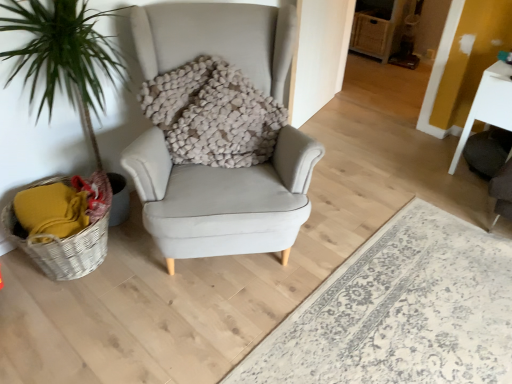
Where is `white glossy table at right`? Image resolution: width=512 pixels, height=384 pixels. white glossy table at right is located at coordinates (489, 105).

Find the location of a particular element. This screenshot has width=512, height=384. fuzzy beige pillow at center is located at coordinates (213, 114).

I want to click on woven wicker basket at lower left, so click(x=63, y=248).

Is light gray fabric armchair at center turned away from fuzzy beige pillow at center?

light gray fabric armchair at center is not turned away from fuzzy beige pillow at center.

Considering the positions of objects light gray fabric armchair at center and fuzzy beige pillow at center in the image provided, who is more to the left, light gray fabric armchair at center or fuzzy beige pillow at center?

fuzzy beige pillow at center.

Is point (343, 380) more distant than point (242, 143)?

No, (343, 380) is in front of (242, 143).

From the image's perspective, which one is positioned lower, light gray fabric armchair at center or fuzzy beige pillow at center?

From the image's view, light gray fabric armchair at center is below.

The width and height of the screenshot is (512, 384). I want to click on plain below the white glossy table at right (from the image's perspective), so click(x=400, y=311).

Is white glossy table at right aimed at light gray fabric armchair at center?

Yes, white glossy table at right faces towards light gray fabric armchair at center.

Is light gray fabric armchair at center a part of white glossy table at right?

That's incorrect, light gray fabric armchair at center is not inside white glossy table at right.

From the image's perspective, is white glossy table at right above light gray fabric armchair at center?

Correct, white glossy table at right appears higher than light gray fabric armchair at center in the image.

How different are the orientations of light gray fabric armchair at center and woven wicker basket at lower left in degrees?

180 degrees separate the facing orientations of light gray fabric armchair at center and woven wicker basket at lower left.

From their relative heights in the image, would you say light gray fabric armchair at center is taller or shorter than woven wicker basket at lower left?

light gray fabric armchair at center is shorter than woven wicker basket at lower left.

Which is in front, point (510, 287) or point (92, 243)?

The point (92, 243) is more forward.

Which is more to the left, woven wicker basket at lower left or light gray fabric armchair at center?

From the viewer's perspective, woven wicker basket at lower left appears more on the left side.

Between woven wicker basket at lower left and light gray fabric armchair at center, which one has less height?

With less height is light gray fabric armchair at center.

Is woven wicker basket at lower left positioned with its back to light gray fabric armchair at center?

No, woven wicker basket at lower left is not facing away from light gray fabric armchair at center.

From the image's perspective, is woven wicker basket at lower left located above or below light gray fabric armchair at center?

→ woven wicker basket at lower left is above light gray fabric armchair at center.

Is fuzzy beige pillow at center in front of or behind light gray fabric armchair at center in the image?

Clearly, fuzzy beige pillow at center is behind light gray fabric armchair at center.

Consider the image. Is fuzzy beige pillow at center wider than light gray fabric armchair at center?

No, fuzzy beige pillow at center is not wider than light gray fabric armchair at center.

From a real-world perspective, is fuzzy beige pillow at center over light gray fabric armchair at center?

Yes.

Measure the distance between fuzzy beige pillow at center and light gray fabric armchair at center.

36.89 inches.

Considering the positions of objects white glossy table at right and woven wicker basket at lower left in the image provided, who is in front, white glossy table at right or woven wicker basket at lower left?

Positioned in front is woven wicker basket at lower left.

From the image's perspective, which one is positioned higher, white glossy table at right or woven wicker basket at lower left?

white glossy table at right is shown above in the image.

Between white glossy table at right and woven wicker basket at lower left, which one appears on the right side from the viewer's perspective?

From the viewer's perspective, white glossy table at right appears more on the right side.

Can you tell me how much white glossy table at right and woven wicker basket at lower left differ in facing direction?

The angle between the facing direction of white glossy table at right and the facing direction of woven wicker basket at lower left is 92.3 degrees.

Is fuzzy beige pillow at center not inside woven wicker basket at lower left?

Absolutely, fuzzy beige pillow at center is external to woven wicker basket at lower left.

From the image's perspective, is fuzzy beige pillow at center on top of woven wicker basket at lower left?

Yes.

You are a GUI agent. You are given a task and a screenshot of the screen. Output one action in this format:
    pyautogui.click(x=<x>, y=<y>)
    Task: Click on the pillow on the right of woven wicker basket at lower left
    This screenshot has width=512, height=384.
    Given the screenshot: What is the action you would take?
    pyautogui.click(x=213, y=114)

Between fuzzy beige pillow at center and woven wicker basket at lower left, which one has larger width?

With larger width is woven wicker basket at lower left.

The height and width of the screenshot is (384, 512). In order to click on pillow that appears on the left of light gray fabric armchair at center in this screenshot , I will do `click(213, 114)`.

Find the location of a particular element. plain in front of the white glossy table at right is located at coordinates (400, 311).

When comparing their distances from fuzzy beige pillow at center, does white glossy table at right or light gray fabric armchair at center seem further?

white glossy table at right is positioned further to the anchor fuzzy beige pillow at center.

Looking at the image, which one is located closer to woven wicker basket at lower left, fuzzy beige pillow at center or light gray fabric armchair at center?

fuzzy beige pillow at center lies closer to woven wicker basket at lower left than the other object.

Which object lies nearer to the anchor point white glossy table at right, fuzzy beige pillow at center or light gray fabric armchair at center?

light gray fabric armchair at center lies closer to white glossy table at right than the other object.

Considering their positions, is white glossy table at right positioned closer to light gray fabric armchair at center than fuzzy beige pillow at center?

fuzzy beige pillow at center lies closer to light gray fabric armchair at center than the other object.

Which object lies nearer to the anchor point woven wicker basket at lower left, light gray fabric armchair at center or fuzzy beige pillow at center?

Based on the image, fuzzy beige pillow at center appears to be nearer to woven wicker basket at lower left.

From the image, which object appears to be nearer to light gray fabric armchair at center, white glossy table at right or woven wicker basket at lower left?

white glossy table at right is positioned closer to the anchor light gray fabric armchair at center.

Estimate the real-world distances between objects in this image. Which object is further from fuzzy beige pillow at center, light gray fabric armchair at center or woven wicker basket at lower left?

Based on the image, light gray fabric armchair at center appears to be further to fuzzy beige pillow at center.

Based on their spatial positions, is fuzzy beige pillow at center or woven wicker basket at lower left further from white glossy table at right?

woven wicker basket at lower left is further to white glossy table at right.

The width and height of the screenshot is (512, 384). I want to click on pillow between woven wicker basket at lower left and white glossy table at right from left to right, so click(213, 114).

I want to click on plain between fuzzy beige pillow at center and white glossy table at right in the horizontal direction, so click(x=400, y=311).

Where is `pillow between woven wicker basket at lower left and light gray fabric armchair at center from left to right`? pillow between woven wicker basket at lower left and light gray fabric armchair at center from left to right is located at coordinates (213, 114).

I want to click on plain situated between woven wicker basket at lower left and white glossy table at right from left to right, so click(x=400, y=311).